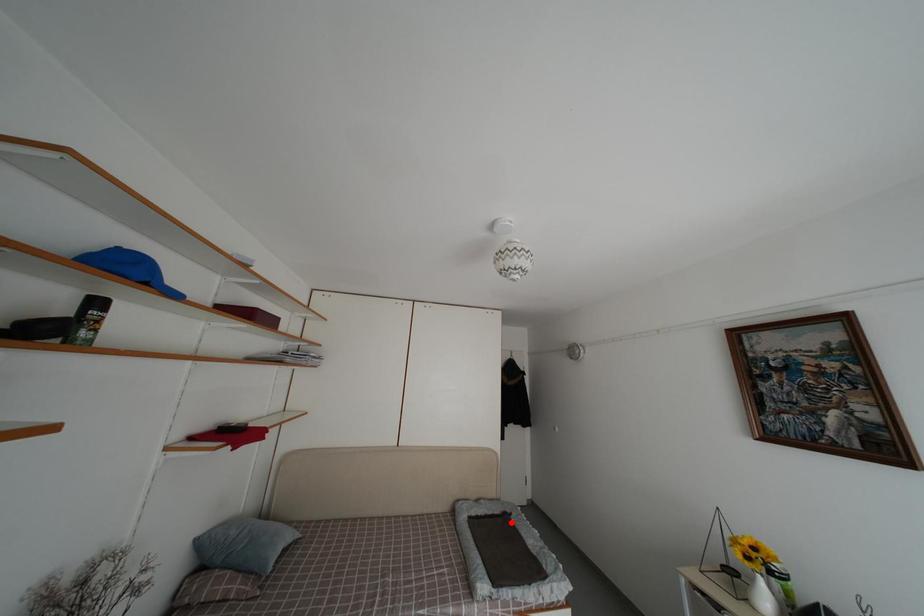
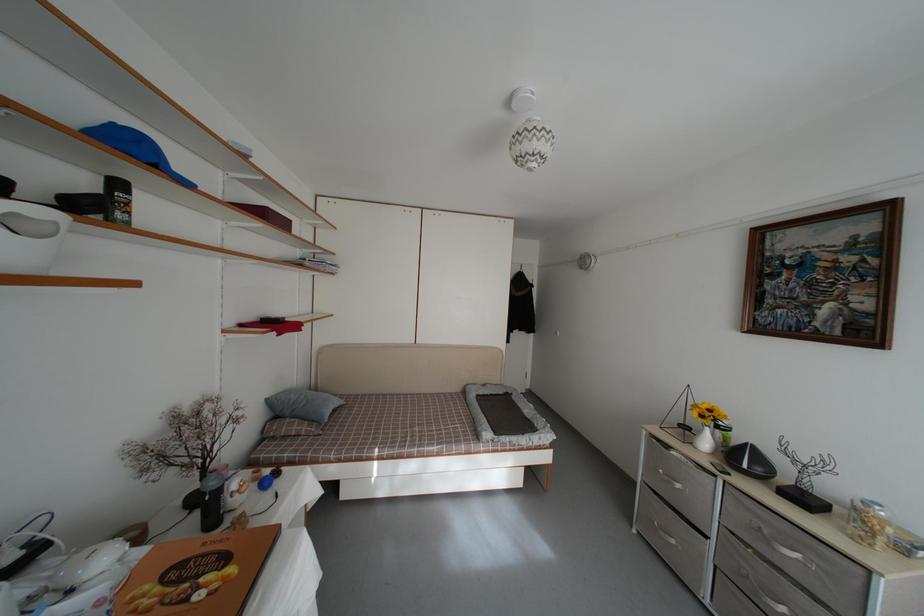
Question: I am providing you with two images of the same scene from different viewpoints. A red point is marked on the first image. At the location where the point appears in image 1, is it still visible in image 2?

Choices:
 (A) Yes
 (B) No

Answer: (A)